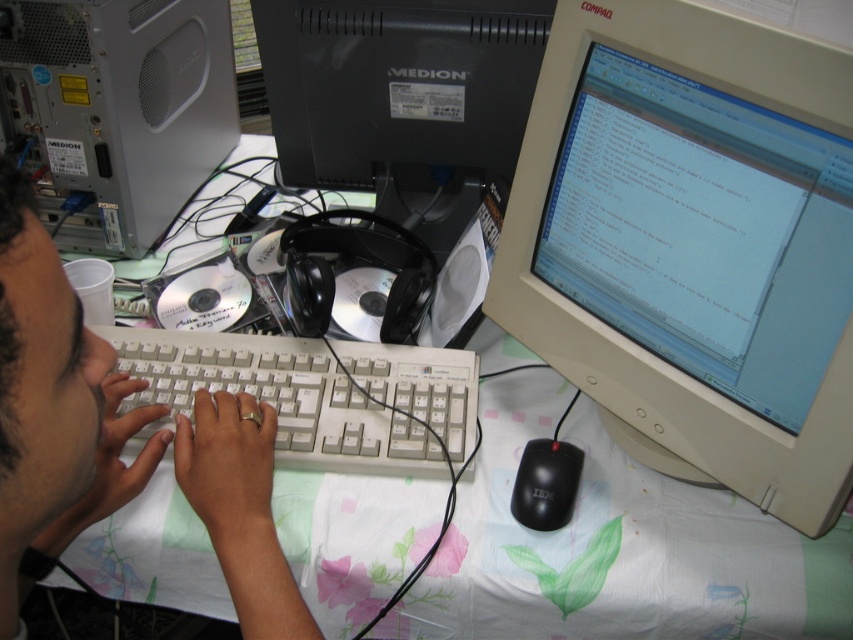
You are a delivery robot with a 20 cm wide package. You need to place the package between the beige plastic monitor at center and the white plastic keyboard at center. Is there enough space between them to fit the package?

The beige plastic monitor at center and white plastic keyboard at center are 25.29 centimeters apart from each other. Since the package is 20 cm wide, there is enough space between them to fit the package.

You are a technician who needs to access the white plastic computer tower at upper left. The minimum recommended distance for safe maintenance is 30 inches. Can you safely perform maintenance on the tower from your current position?

The white plastic computer tower at upper left is 33.16 inches away from the viewer, which exceeds the minimum recommended distance of 30 inches. Therefore, you can safely perform maintenance on the tower from your current position.

You are a delivery robot with a height of 30 inches. You need to place a package on the table at point (734, 461). Can you reach the table at that point?

The distance of point (734, 461) from camera is 26.25 inches, so the robot can reach the table at that point since it is within the robot height of 30 inches.